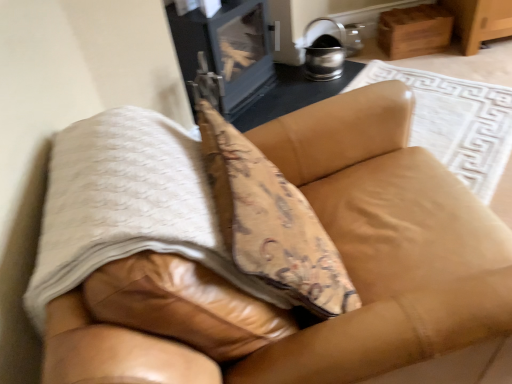
Question: Does metallic silver stove at upper center have a lesser width compared to leather couch at center?

Choices:
 (A) yes
 (B) no

Answer: (A)

Question: From a real-world perspective, is metallic silver stove at upper center under leather couch at center?

Choices:
 (A) yes
 (B) no

Answer: (A)

Question: Is metallic silver stove at upper center completely or partially outside of leather couch at center?

Choices:
 (A) no
 (B) yes

Answer: (B)

Question: Is metallic silver stove at upper center to the right of leather couch at center from the viewer's perspective?

Choices:
 (A) yes
 (B) no

Answer: (B)

Question: Is metallic silver stove at upper center closer to the viewer compared to leather couch at center?

Choices:
 (A) yes
 (B) no

Answer: (B)

Question: Does metallic silver stove at upper center have a larger size compared to leather couch at center?

Choices:
 (A) no
 (B) yes

Answer: (A)

Question: Considering the relative positions of white textured blanket at center and leather couch at center in the image provided, is white textured blanket at center to the right of leather couch at center from the viewer's perspective?

Choices:
 (A) yes
 (B) no

Answer: (B)

Question: Is white textured blanket at center outside of leather couch at center?

Choices:
 (A) no
 (B) yes

Answer: (A)

Question: From a real-world perspective, is white textured blanket at center beneath leather couch at center?

Choices:
 (A) no
 (B) yes

Answer: (A)

Question: Does white textured blanket at center have a greater height compared to leather couch at center?

Choices:
 (A) no
 (B) yes

Answer: (A)

Question: From the image's perspective, is white textured blanket at center under leather couch at center?

Choices:
 (A) yes
 (B) no

Answer: (B)

Question: Does white textured blanket at center have a lesser height compared to leather couch at center?

Choices:
 (A) no
 (B) yes

Answer: (B)

Question: Is metallic silver stove at upper center to the left of white textured blanket at center from the viewer's perspective?

Choices:
 (A) no
 (B) yes

Answer: (A)